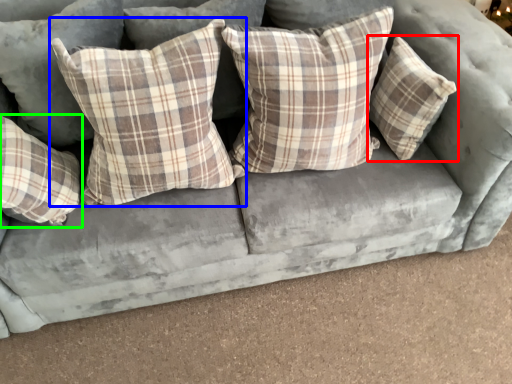
Question: Which object is the farthest from pillow (highlighted by a red box)? Choose among these: pillow (highlighted by a blue box) or pillow (highlighted by a green box).

Choices:
 (A) pillow
 (B) pillow

Answer: (B)